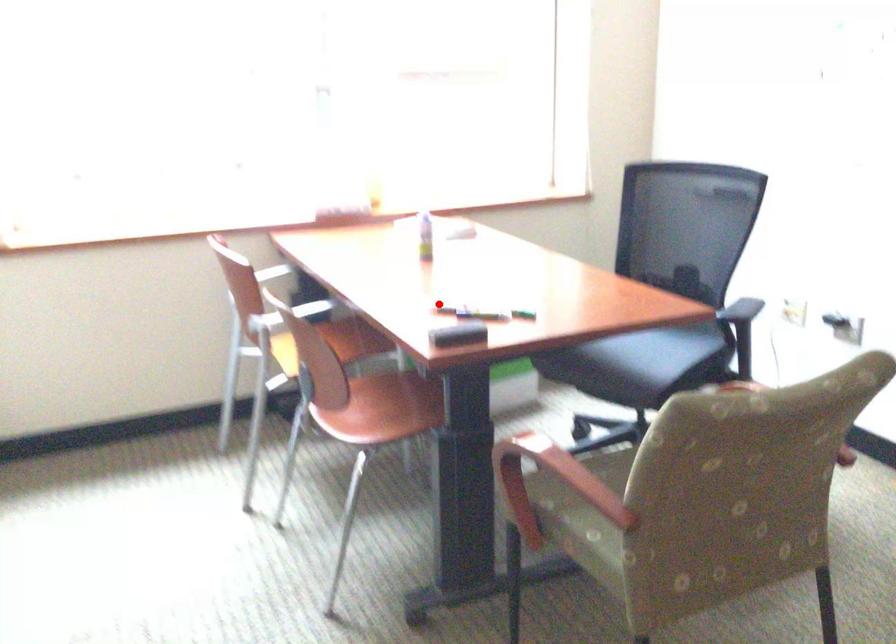
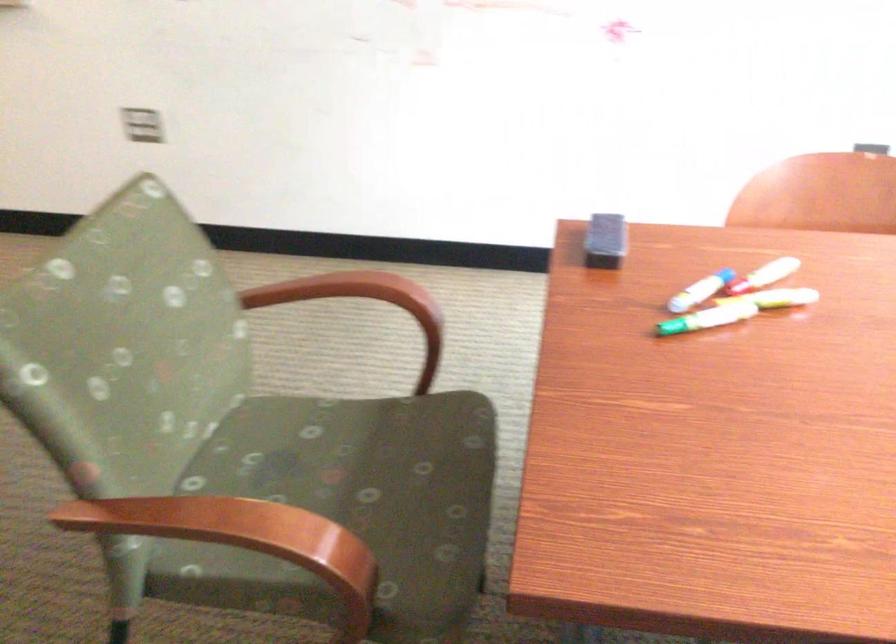
Question: I am providing you with two images of the same scene from different viewpoints. A red point is shown in image1. For the corresponding object point in image2, is it positioned nearer or farther from the camera?

Choices:
 (A) Nearer
 (B) Farther

Answer: (A)